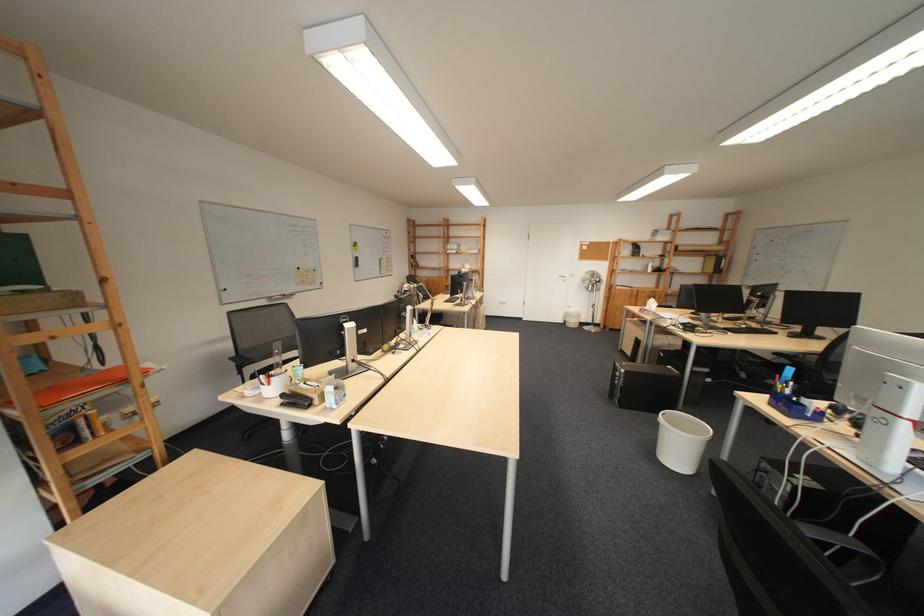
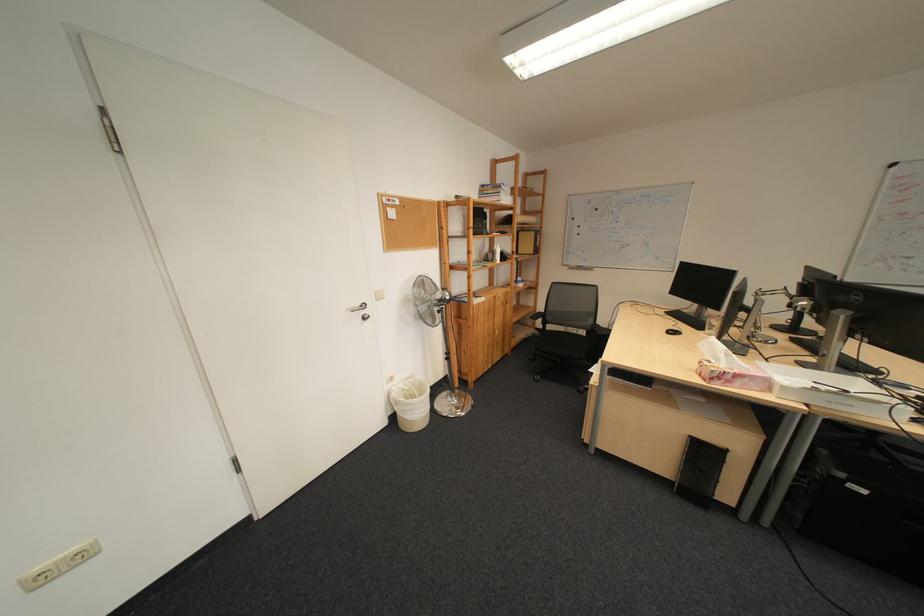
Find the pixel in the second image that matches point (608, 275) in the first image.

(435, 284)